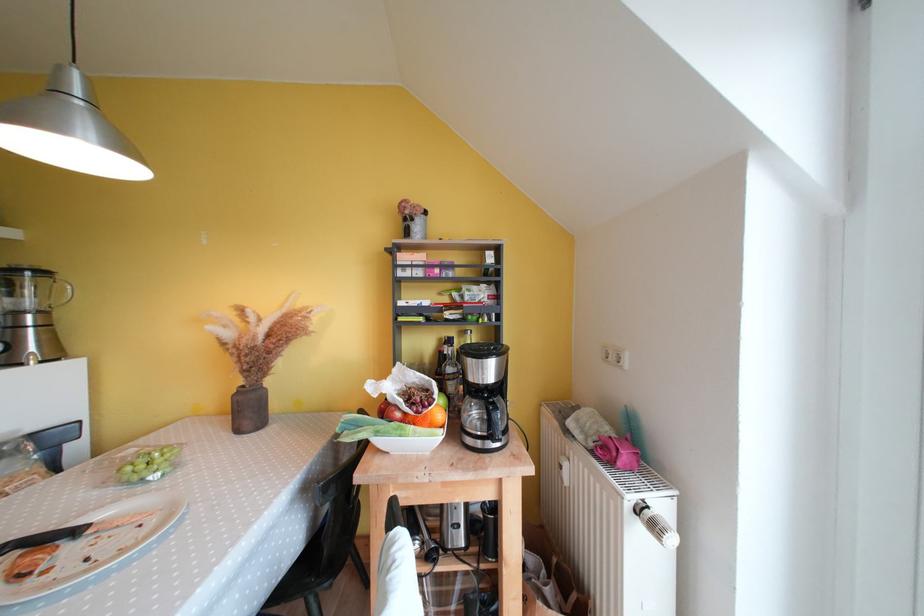
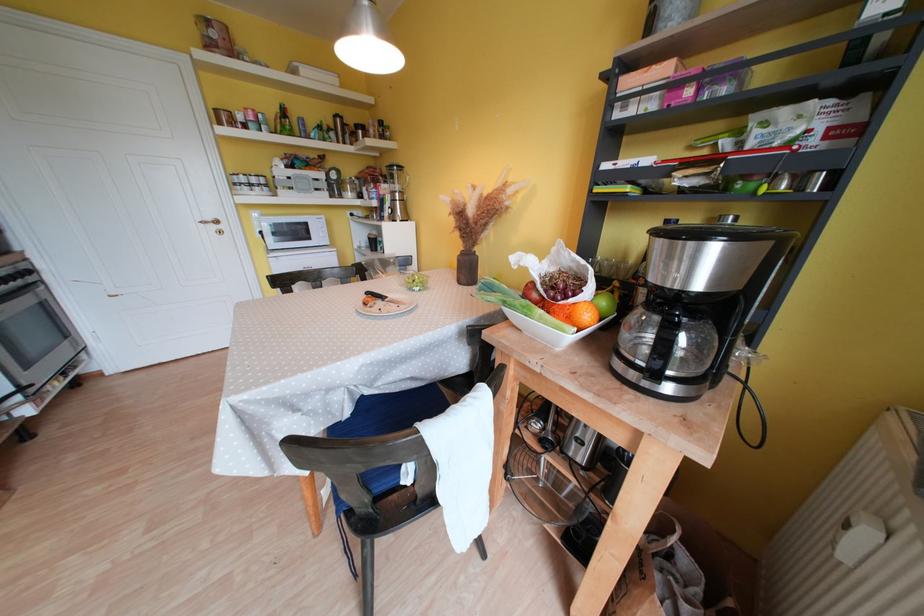
The point at (83,535) is marked in the first image. Where is the corresponding point in the second image?

(390, 301)